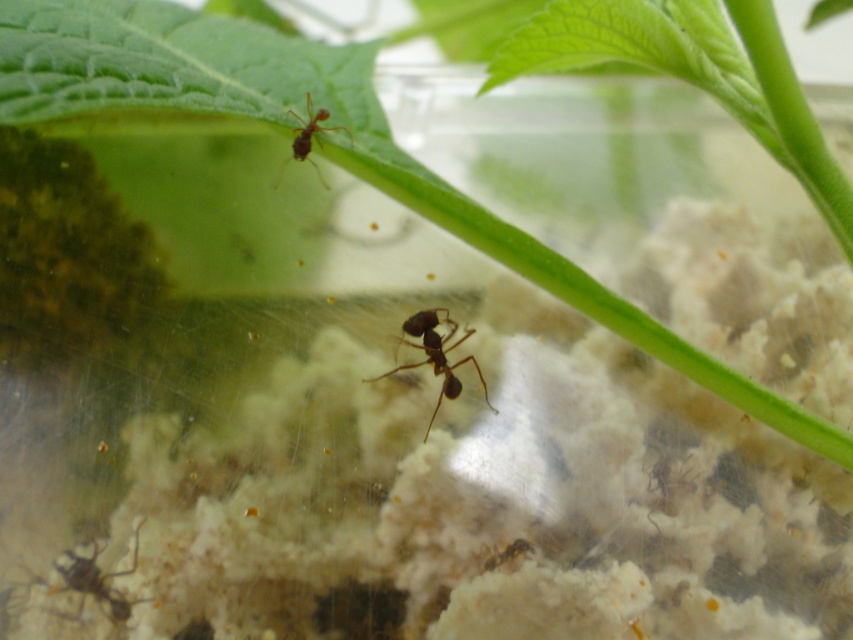
You are an entomologist observing the ants in the terrarium. You notice the shiny brown ant at center and the brown matte ant at lower left. Which ant is wider?

The shiny brown ant at center is wider than the brown matte ant at lower left.

You are an entomologist observing ants in an enclosure. You notice two ants, the shiny brown ant at center and the brown matte ant at upper center. Which ant is positioned higher up in the image?

The brown matte ant at upper center is positioned higher up in the image than the shiny brown ant at center.

You are an entomologist observing this ant enclosure. You notice two ants labeled as brown matte ant at lower left and brown matte ant at upper center. Which ant is positioned lower in the enclosure?

The brown matte ant at lower left is positioned lower in the enclosure than the brown matte ant at upper center.